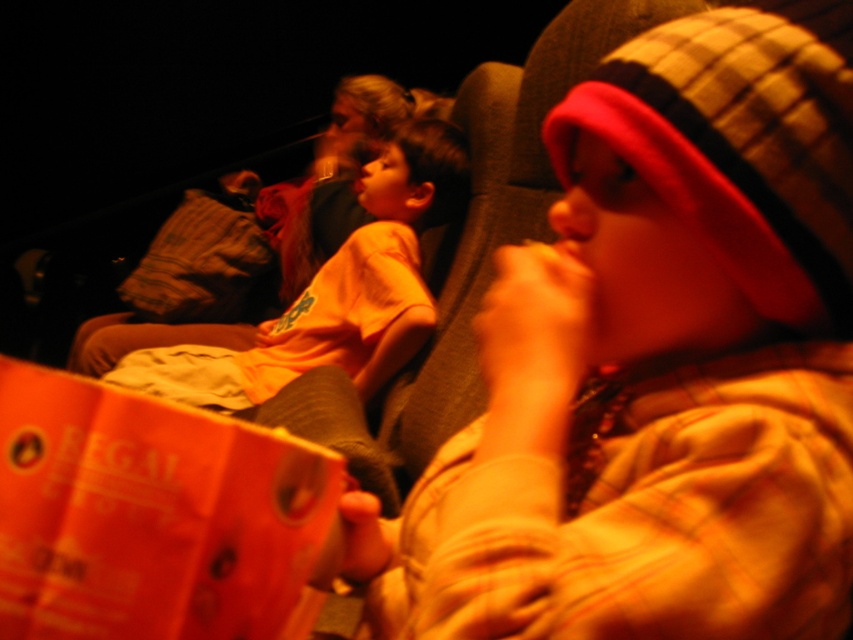
Is orange paper at center closer to camera compared to plaid fabric hat at upper right?

That is True.

Is orange paper at center to the left of plaid fabric hat at upper right from the viewer's perspective?

Yes, orange paper at center is to the left of plaid fabric hat at upper right.

Locate an element on the screen. The width and height of the screenshot is (853, 640). orange paper at center is located at coordinates (149, 515).

I want to click on orange paper at center, so click(149, 515).

Between plaid fabric hat at upper right and orange cotton shirt at center, which one is positioned lower?

orange cotton shirt at center is lower down.

Is plaid fabric hat at upper right positioned in front of orange cotton shirt at center?

Yes, plaid fabric hat at upper right is closer to the viewer.

Is point (790, 221) positioned in front of point (393, 252)?

Yes.

Locate an element on the screen. This screenshot has width=853, height=640. plaid fabric hat at upper right is located at coordinates coord(740,144).

Is orange paper at center wider than orange cotton shirt at center?

No, orange paper at center is not wider than orange cotton shirt at center.

Image resolution: width=853 pixels, height=640 pixels. I want to click on orange paper at center, so click(149, 515).

Is point (149, 602) closer to camera compared to point (357, 304)?

Yes, it is.

Locate an element on the screen. This screenshot has width=853, height=640. orange paper at center is located at coordinates (149, 515).